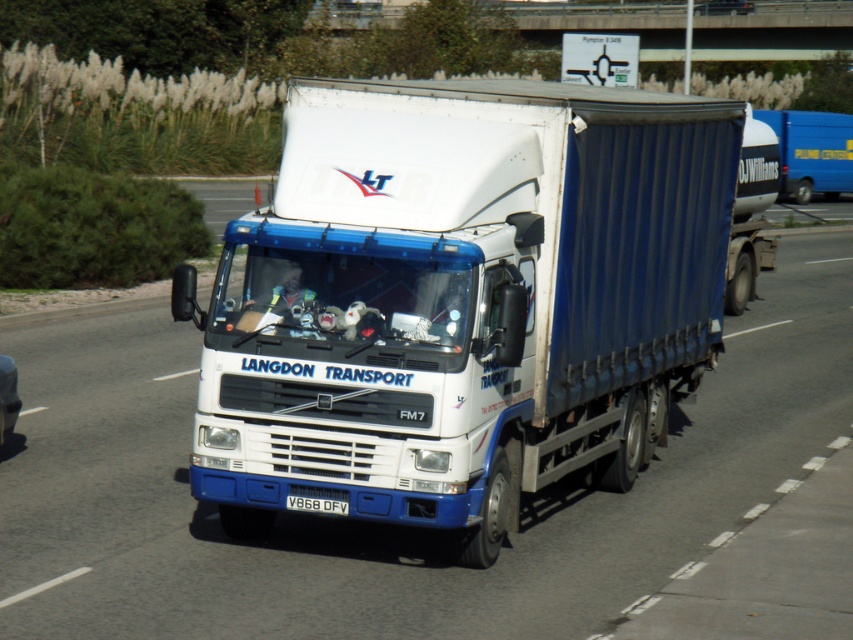
Question: Does white plastic truck at center appear on the left side of metallic silver car at left?

Choices:
 (A) yes
 (B) no

Answer: (B)

Question: Which is nearer to the blue matte truck at center?

Choices:
 (A) white plastic license plate at center
 (B) metallic blue truck at center
 (C) metallic silver car at left

Answer: (B)

Question: Which point appears closest to the camera in this image?

Choices:
 (A) (766, 116)
 (B) (178, 604)
 (C) (587, 458)

Answer: (B)

Question: Considering the real-world distances, which object is farthest from the white plastic truck at center?

Choices:
 (A) white matte truck at center
 (B) metallic blue truck at center
 (C) white plastic license plate at center
 (D) blue matte truck at center

Answer: (B)

Question: Does blue matte truck at center appear on the left side of white plastic license plate at center?

Choices:
 (A) no
 (B) yes

Answer: (A)

Question: Can you confirm if white matte truck at center is wider than metallic silver car at left?

Choices:
 (A) yes
 (B) no

Answer: (A)